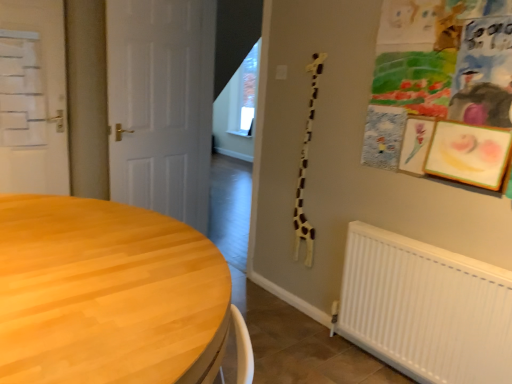
Question: From the image's perspective, would you say white matte door at left, which ranks as the 2th door in right-to-left order, is positioned over wooden table at lower left?

Choices:
 (A) yes
 (B) no

Answer: (A)

Question: Considering the relative sizes of white matte door at left, which ranks as the first door in left-to-right order, and wooden table at lower left in the image provided, is white matte door at left, which ranks as the first door in left-to-right order, wider than wooden table at lower left?

Choices:
 (A) no
 (B) yes

Answer: (A)

Question: Could you tell me if white matte door at left, which ranks as the first door in left-to-right order, is turned towards wooden table at lower left?

Choices:
 (A) no
 (B) yes

Answer: (B)

Question: Is white matte door at left, which ranks as the 2th door in right-to-left order, positioned in front of wooden table at lower left?

Choices:
 (A) yes
 (B) no

Answer: (B)

Question: Does white matte door at left, which ranks as the 2th door in right-to-left order, have a smaller size compared to wooden table at lower left?

Choices:
 (A) no
 (B) yes

Answer: (B)

Question: Does white matte door at left, which ranks as the first door in left-to-right order, appear on the left side of wooden table at lower left?

Choices:
 (A) no
 (B) yes

Answer: (B)

Question: Are white matte door at left, which ranks as the first door in left-to-right order, and white matte door at center, marked as the 1th door in a right-to-left arrangement, far apart?

Choices:
 (A) yes
 (B) no

Answer: (B)

Question: Is white matte door at center, marked as the 1th door in a right-to-left arrangement, a part of white matte door at left, which ranks as the 2th door in right-to-left order?

Choices:
 (A) yes
 (B) no

Answer: (B)

Question: Considering the relative sizes of white matte door at left, which ranks as the first door in left-to-right order, and white matte door at center, the 2th door viewed from the left, in the image provided, is white matte door at left, which ranks as the first door in left-to-right order, shorter than white matte door at center, the 2th door viewed from the left,?

Choices:
 (A) no
 (B) yes

Answer: (B)

Question: From the image's perspective, does white matte door at left, which ranks as the 2th door in right-to-left order, appear higher than white matte door at center, marked as the 1th door in a right-to-left arrangement?

Choices:
 (A) yes
 (B) no

Answer: (A)

Question: Is white matte door at left, which ranks as the 2th door in right-to-left order, at the right side of white matte door at center, marked as the 1th door in a right-to-left arrangement?

Choices:
 (A) no
 (B) yes

Answer: (A)

Question: Does white matte door at left, which ranks as the 2th door in right-to-left order, turn towards white matte door at center, the 2th door viewed from the left?

Choices:
 (A) no
 (B) yes

Answer: (A)

Question: From a real-world perspective, is wooden table at lower left located higher than white matte door at left, which ranks as the first door in left-to-right order?

Choices:
 (A) no
 (B) yes

Answer: (A)